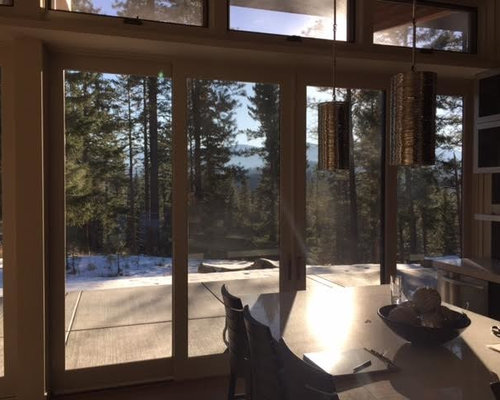
Locate an element on the screen. This screenshot has height=400, width=500. window is located at coordinates (186, 9), (271, 16), (401, 40), (429, 225), (134, 223).